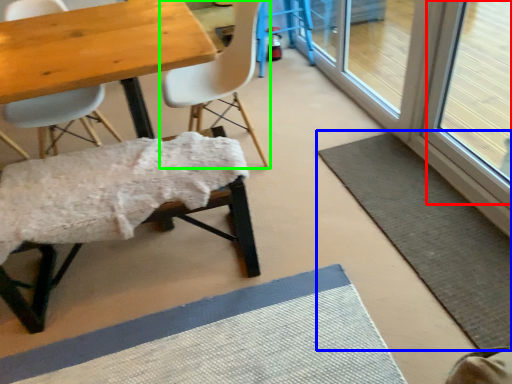
Question: Based on their relative distances, which object is farther from window screen (highlighted by a red box)? Choose from bath mat (highlighted by a blue box) and chair (highlighted by a green box).

Choices:
 (A) bath mat
 (B) chair

Answer: (B)